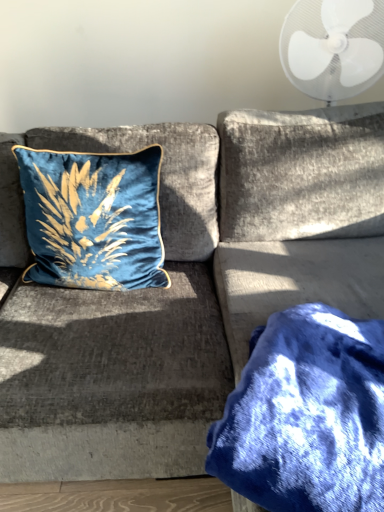
Question: From the image's perspective, relative to blue fuzzy blanket at lower right, is velvet blue pillow at upper left above or below?

Choices:
 (A) above
 (B) below

Answer: (A)

Question: Does point (139, 274) appear closer or farther from the camera than point (357, 456)?

Choices:
 (A) farther
 (B) closer

Answer: (A)

Question: Which is nearer to the blue fuzzy blanket at lower right?

Choices:
 (A) velvet blue pillow at upper left
 (B) white plastic fan at upper right

Answer: (A)

Question: Which object is the farthest from the blue fuzzy blanket at lower right?

Choices:
 (A) white plastic fan at upper right
 (B) velvet blue pillow at upper left

Answer: (A)